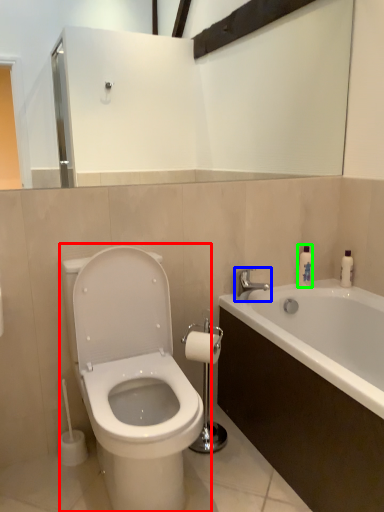
Question: Estimate the real-world distances between objects in this image. Which object is closer to toilet (highlighted by a red box), tap (highlighted by a blue box) or soap dispenser (highlighted by a green box)?

Choices:
 (A) tap
 (B) soap dispenser

Answer: (A)